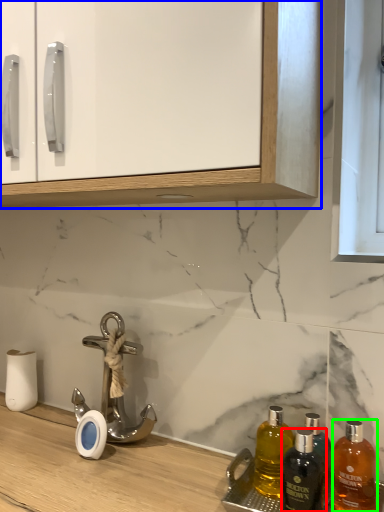
Question: Which object is positioned farthest from bottle (highlighted by a red box)? Select from cabinetry (highlighted by a blue box) and bottle (highlighted by a green box).

Choices:
 (A) cabinetry
 (B) bottle

Answer: (A)